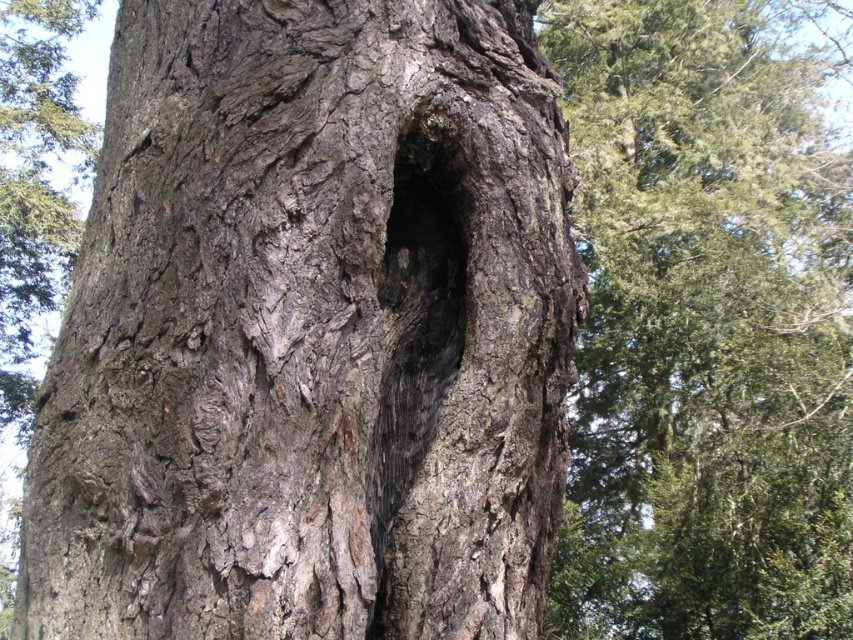
Can you confirm if smooth bark tree trunk at center is shorter than dark wood hole at center?

No, smooth bark tree trunk at center is not shorter than dark wood hole at center.

Does smooth bark tree trunk at center have a larger size compared to dark wood hole at center?

Yes, smooth bark tree trunk at center is bigger than dark wood hole at center.

Identify the location of smooth bark tree trunk at center. This screenshot has height=640, width=853. (704, 330).

The height and width of the screenshot is (640, 853). Identify the location of smooth bark tree trunk at center. (704, 330).

How much distance is there between dark gray rough bark at center and dark wood hole at center?

dark gray rough bark at center is 9.79 inches from dark wood hole at center.

Does dark gray rough bark at center appear over dark wood hole at center?

Yes.

At what (x,y) coordinates should I click in order to perform the action: click on dark gray rough bark at center. Please return your answer as a coordinate pair (x, y). Looking at the image, I should click on (311, 332).

Measure the distance from dark gray rough bark at center to smooth bark tree trunk at center.

4.12 meters

Who is more distant from viewer, (413, 109) or (660, 198)?

The point (660, 198) is more distant.

Who is more distant from viewer, (135, 484) or (778, 353)?

The point (778, 353) is more distant.

The height and width of the screenshot is (640, 853). Identify the location of dark gray rough bark at center. coord(311,332).